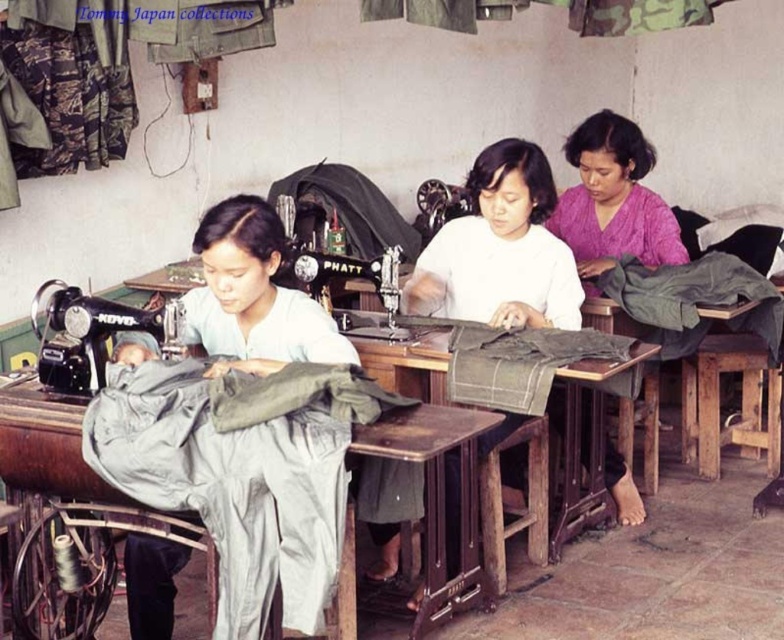
Does metallic black sewing machine at left have a lesser height compared to metallic black sewing machine at center?

Yes.

Between point (37, 360) and point (427, 209), which one is positioned behind?

The point (427, 209) is more distant.

Locate an element on the screen. The height and width of the screenshot is (640, 784). metallic black sewing machine at left is located at coordinates (93, 333).

The image size is (784, 640). I want to click on matte gray fabric at center, so click(x=252, y=296).

Between point (230, 588) and point (459, 204), which one is positioned in front?

Positioned in front is point (230, 588).

The image size is (784, 640). Find the location of `matte gray fabric at center`. matte gray fabric at center is located at coordinates click(252, 296).

Who is more distant from viewer, (209, 444) or (452, 502)?

Point (452, 502)

The image size is (784, 640). Find the location of `matte gray fabric at center`. matte gray fabric at center is located at coordinates (252, 296).

Where is `matte gray fabric at center`? This screenshot has height=640, width=784. matte gray fabric at center is located at coordinates (252, 296).